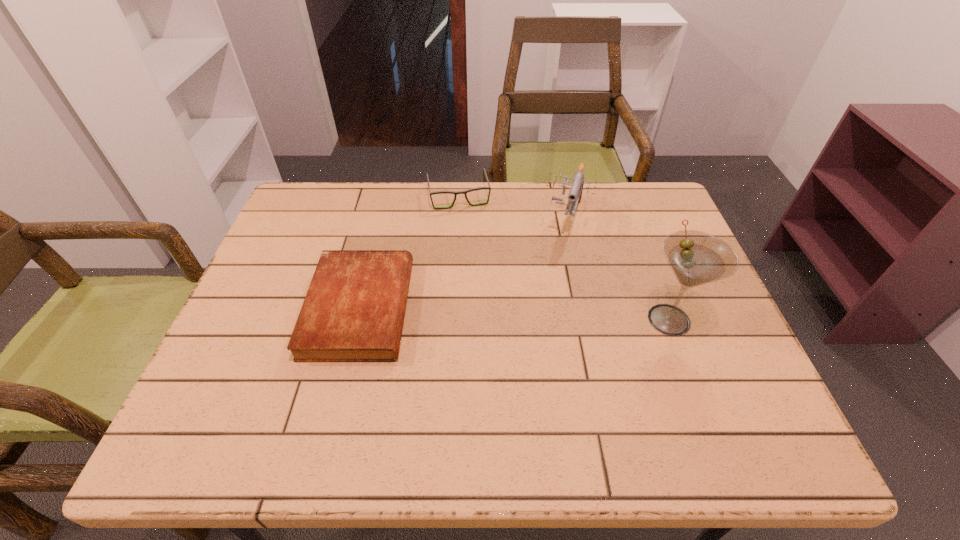
In the image, there is a desktop. What are the coordinates of `vacant space at the near edge` in the screenshot? It's located at (629, 387).

In the image, there is a desktop. Where is `free space at the left edge`? free space at the left edge is located at coordinates [x=321, y=244].

Where is `vacant region at the right edge of the desktop`? This screenshot has height=540, width=960. vacant region at the right edge of the desktop is located at coordinates (645, 278).

Where is `vacant space at the far left corner`? vacant space at the far left corner is located at coordinates (295, 198).

In order to click on vacant space at the near left corner of the desktop in this screenshot , I will do `click(218, 382)`.

This screenshot has height=540, width=960. What are the coordinates of `vacant space at the near right corner of the desktop` in the screenshot? It's located at coord(744,374).

Find the location of `vacant area that lies between the spectacles and the martini`. vacant area that lies between the spectacles and the martini is located at coordinates (564, 258).

At what (x,y) coordinates should I click in order to perform the action: click on vacant region between the spectacles and the tallest object. Please return your answer as a coordinate pair (x, y). This screenshot has width=960, height=540. Looking at the image, I should click on (564, 258).

Locate an element on the screen. empty location between the tallest object and the second shortest object is located at coordinates (564, 258).

This screenshot has width=960, height=540. Identify the location of vacant space in between the rightmost object and the third shortest object. (618, 268).